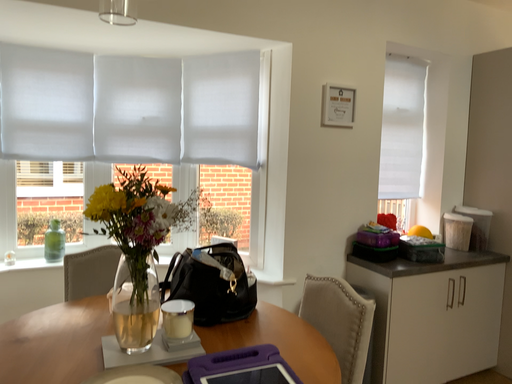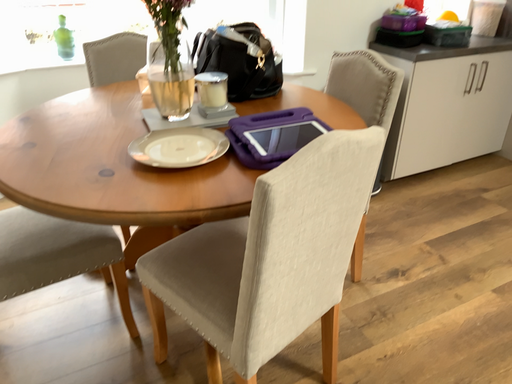
Question: How did the camera likely rotate when shooting the video?

Choices:
 (A) rotated upward
 (B) rotated downward

Answer: (B)